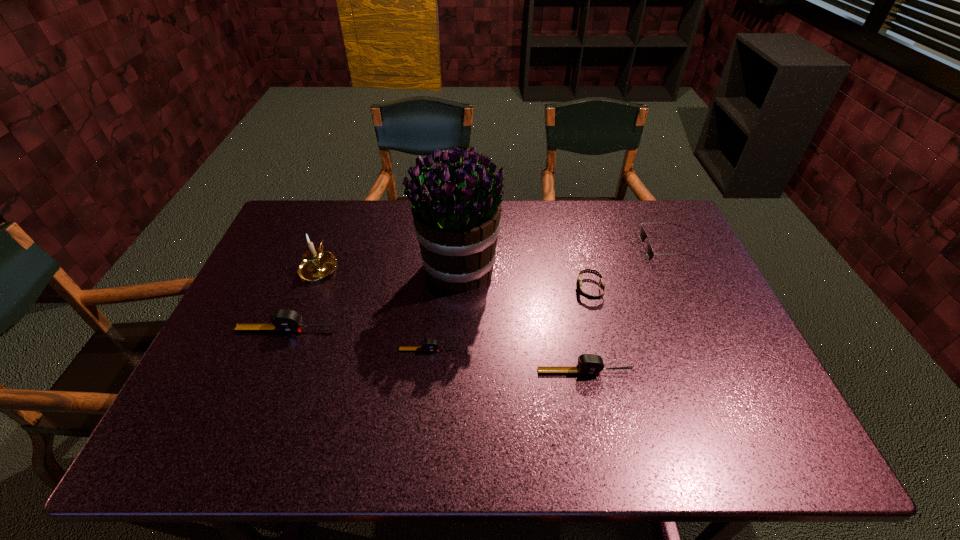
This screenshot has width=960, height=540. I want to click on object that is the closest to the third nearest object, so click(x=317, y=264).

The image size is (960, 540). Identify the location of object that can be found as the third closest to the watch. (456, 215).

Point out which tape measure is positioned as the second nearest to the second tape measure from left to right. Please provide its 2D coordinates. Your answer should be formatted as a tuple, i.e. [(x, y)], where the tuple contains the x and y coordinates of a point satisfying the conditions above.

[(588, 364)]

Find the location of a particular element. the third closest tape measure relative to the candle holder is located at coordinates (588, 364).

This screenshot has height=540, width=960. Identify the location of blank area in the image that satisfies the following two spatial constraints: 1. on the front-facing side of the sunglasses; 2. on the front side of the leftmost tape measure. (704, 330).

What are the coordinates of `free spot that satisfies the following two spatial constraints: 1. on the back side of the second nearest object; 2. on the left side of the tallest object` in the screenshot? It's located at (438, 270).

Find the location of a particular element. This screenshot has height=540, width=960. free spot that satisfies the following two spatial constraints: 1. on the front side of the fourth shortest object; 2. on the left side of the shortest tape measure is located at coordinates (427, 372).

At what (x,y) coordinates should I click in order to perform the action: click on vacant space that satisfies the following two spatial constraints: 1. on the front-facing side of the sunglasses; 2. on the front side of the shortest tape measure. Please return your answer as a coordinate pair (x, y). Looking at the image, I should click on (713, 350).